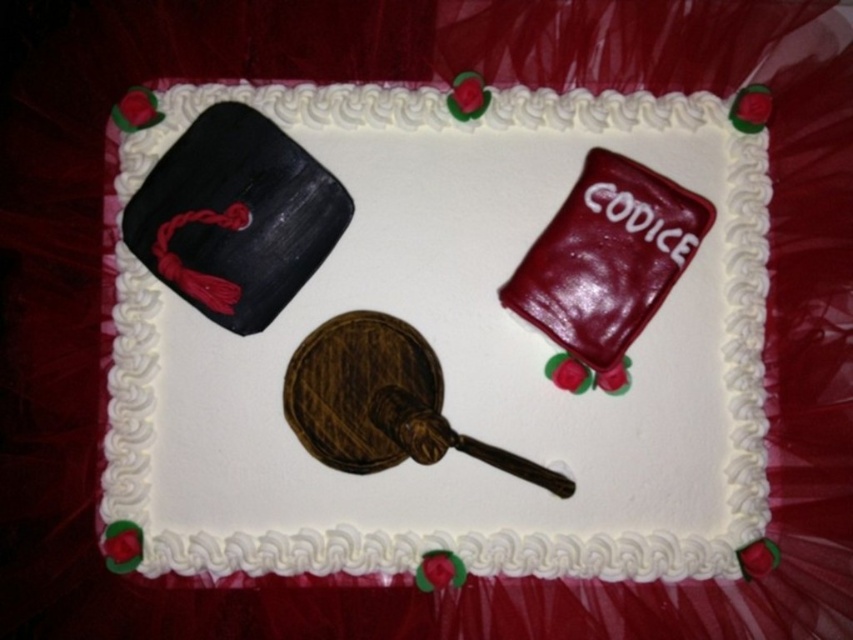
Does matte black hat at upper left have a greater width compared to shiny black hat at upper left?

Correct, the width of matte black hat at upper left exceeds that of shiny black hat at upper left.

Can you confirm if matte black hat at upper left is smaller than shiny black hat at upper left?

No, matte black hat at upper left is not smaller than shiny black hat at upper left.

Is point (305, 317) farther from viewer compared to point (293, 157)?

Yes, it is behind point (293, 157).

You are a GUI agent. You are given a task and a screenshot of the screen. Output one action in this format:
    pyautogui.click(x=<x>, y=<y>)
    Task: Click on the matte black hat at upper left
    The image size is (853, 640).
    Given the screenshot: What is the action you would take?
    pyautogui.click(x=456, y=353)